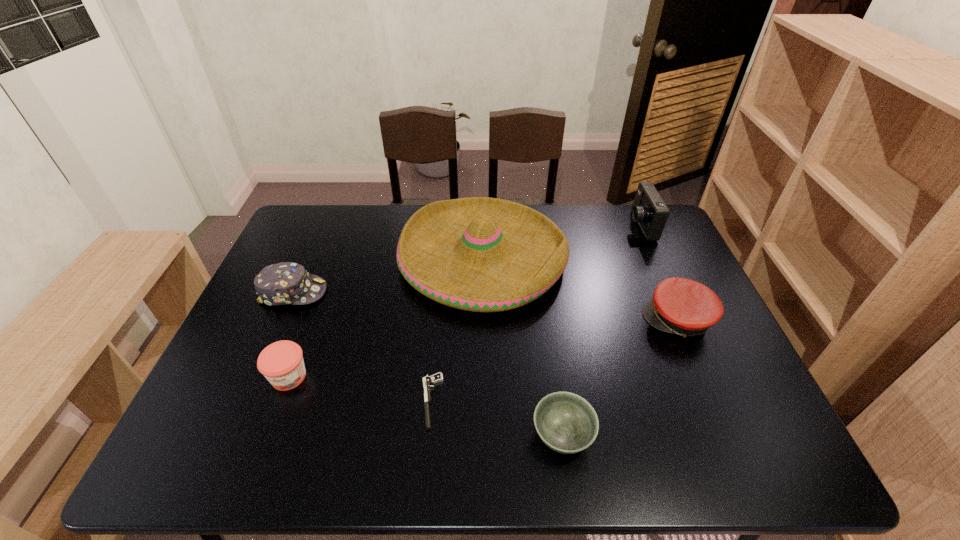
You are a GUI agent. You are given a task and a screenshot of the screen. Output one action in this format:
    pyautogui.click(x=<x>, y=<y>)
    Task: Click on the sombrero that is at the far edge
    
    Given the screenshot: What is the action you would take?
    pyautogui.click(x=480, y=254)

At what (x,y) coordinates should I click in order to perform the action: click on camera that is positioned at the far edge. Please return your answer as a coordinate pair (x, y). The image size is (960, 540). Looking at the image, I should click on (649, 210).

Find the location of a particular element. Image resolution: width=960 pixels, height=540 pixels. object at the near edge is located at coordinates (567, 423).

This screenshot has height=540, width=960. Identify the location of headwear positioned at the left edge. (285, 283).

Where is `jam at the left edge`? This screenshot has height=540, width=960. jam at the left edge is located at coordinates (282, 364).

The width and height of the screenshot is (960, 540). Find the location of `camera at the right edge`. camera at the right edge is located at coordinates (649, 210).

The width and height of the screenshot is (960, 540). What are the coordinates of `cap that is at the right edge` in the screenshot? It's located at (680, 306).

Where is `object that is at the far right corner`? This screenshot has height=540, width=960. object that is at the far right corner is located at coordinates (649, 210).

In the image, there is a desktop. Where is `vacant space at the far edge`? vacant space at the far edge is located at coordinates (373, 225).

This screenshot has height=540, width=960. In the image, there is a desktop. What are the coordinates of `free space at the near edge` in the screenshot? It's located at (506, 430).